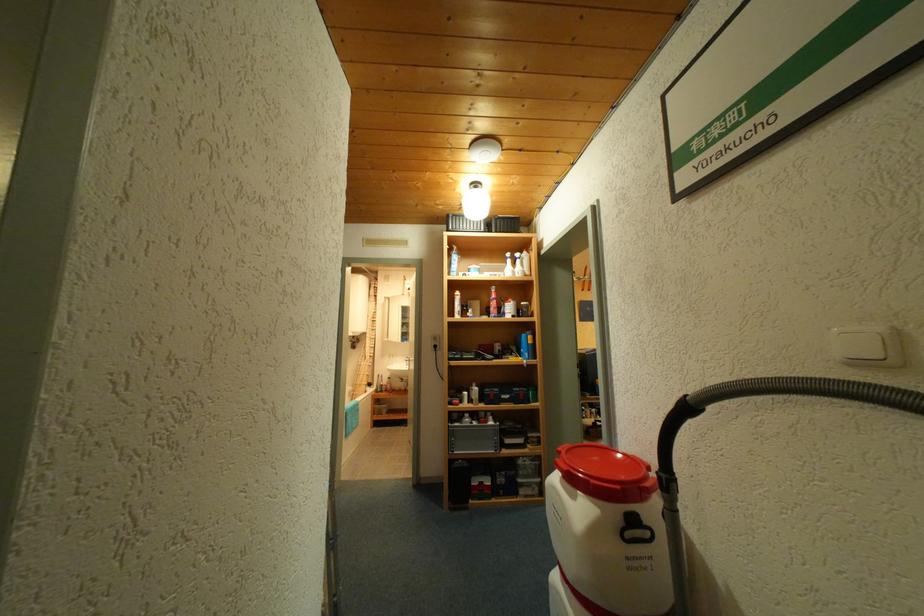
Image resolution: width=924 pixels, height=616 pixels. What do you see at coordinates (602, 463) in the screenshot? I see `the red container lid` at bounding box center [602, 463].